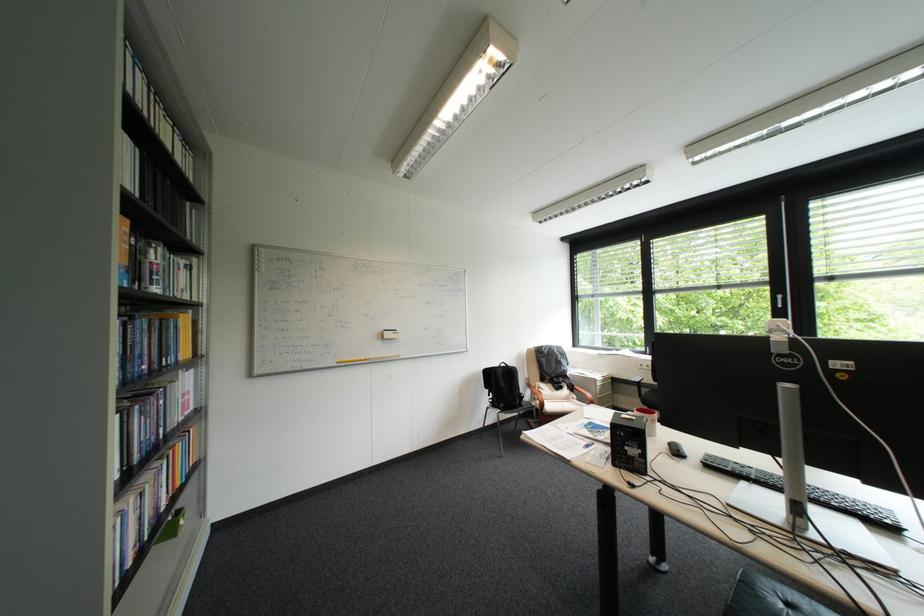
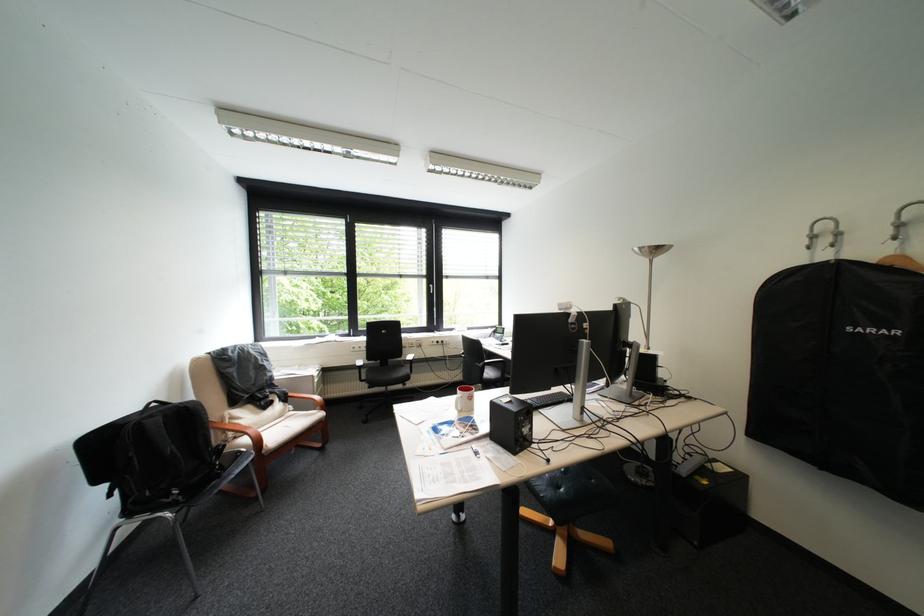
Find the pixel in the second image that matches point (650, 385) in the first image.

(371, 368)